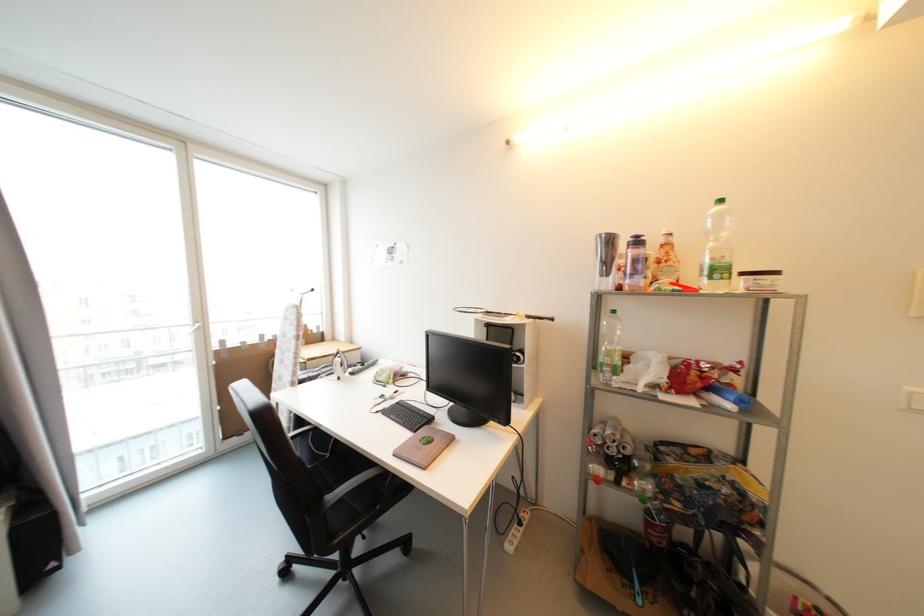
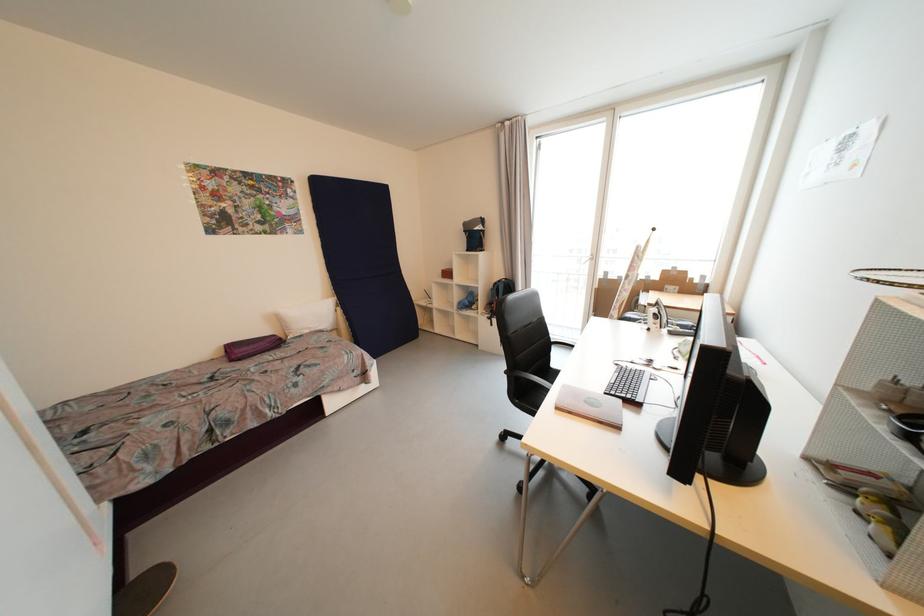
The point at (430,469) is marked in the first image. Where is the corresponding point in the second image?

(562, 410)